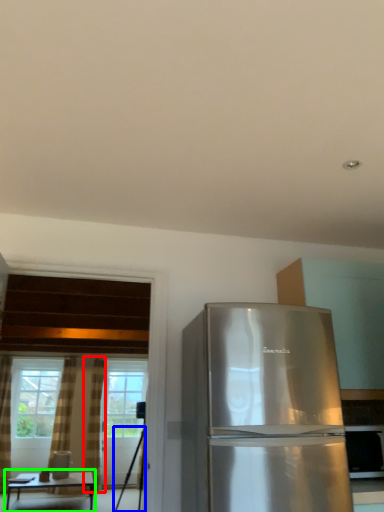
Question: Which is farther away from curtain (highlighted by a red box)? tripod (highlighted by a blue box) or table (highlighted by a green box)?

Choices:
 (A) tripod
 (B) table

Answer: (A)